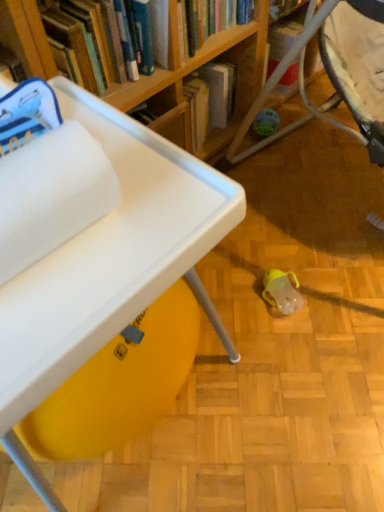
The width and height of the screenshot is (384, 512). What do you see at coordinates (51, 194) in the screenshot? I see `white fluffy towel at upper left` at bounding box center [51, 194].

You are a GUI agent. You are given a task and a screenshot of the screen. Output one action in this format:
    pyautogui.click(x=<x>, y=<y>)
    Task: Click on the white fluffy towel at upper left
    Image resolution: width=384 pixels, height=512 pixels.
    Given the screenshot: What is the action you would take?
    pyautogui.click(x=51, y=194)

Image resolution: width=384 pixels, height=512 pixels. Identify the location of wooden bookshelf at upper center. (196, 68).

Which of these two, white fluffy towel at upper left or wooden bookshelf at upper center, is smaller?

With smaller size is white fluffy towel at upper left.

Is point (17, 195) closer or farther from the camera than point (229, 47)?

Point (17, 195) is closer to the camera than point (229, 47).

Which object is thinner, white fluffy towel at upper left or wooden bookshelf at upper center?

Thinner between the two is white fluffy towel at upper left.

Which object is positioned more to the left, white fluffy towel at upper left or wooden bookshelf at upper center?

From the viewer's perspective, wooden bookshelf at upper center appears more on the left side.

From a real-world perspective, is white plastic table at lower left under wooden bookshelf at upper center?

Correct, in the physical world, white plastic table at lower left is lower than wooden bookshelf at upper center.

Is white plastic table at lower left beside wooden bookshelf at upper center?

They are not placed beside each other.

From the image's perspective, which object appears higher, white plastic table at lower left or wooden bookshelf at upper center?

wooden bookshelf at upper center.

Can you confirm if white plastic table at lower left is positioned to the left of wooden bookshelf at upper center?

Incorrect, white plastic table at lower left is not on the left side of wooden bookshelf at upper center.

From their relative heights in the image, would you say wooden bookshelf at upper center is taller or shorter than white fluffy towel at upper left?

Considering their sizes, wooden bookshelf at upper center has more height than white fluffy towel at upper left.

Looking at this image, is wooden bookshelf at upper center beside white fluffy towel at upper left?

wooden bookshelf at upper center is not next to white fluffy towel at upper left, and they're not touching.

You are a GUI agent. You are given a task and a screenshot of the screen. Output one action in this format:
    pyautogui.click(x=<x>, y=<y>)
    Task: Click on the toilet paper above the wooden bookshelf at upper center (from a real-world perspective)
    Image resolution: width=384 pixels, height=512 pixels.
    Given the screenshot: What is the action you would take?
    pyautogui.click(x=51, y=194)

Is white plastic table at lower left to the left of white fluffy towel at upper left from the viewer's perspective?

In fact, white plastic table at lower left is to the right of white fluffy towel at upper left.

In order to click on toilet paper positioned vertically above the white plastic table at lower left (from a real-world perspective) in this screenshot , I will do `click(51, 194)`.

From a real-world perspective, is white plastic table at lower left above or below white fluffy towel at upper left?

white plastic table at lower left is situated lower than white fluffy towel at upper left in the real world.

From the image's perspective, relative to white fluffy towel at upper left, is white plastic table at lower left above or below?

Based on their image positions, white plastic table at lower left is located beneath white fluffy towel at upper left.

Where is `toilet paper that appears above the white plastic table at lower left (from the image's perspective)`? toilet paper that appears above the white plastic table at lower left (from the image's perspective) is located at coordinates (51, 194).

Is white fluffy towel at upper left further to the viewer compared to white plastic table at lower left?

No, white fluffy towel at upper left is in front of white plastic table at lower left.

Considering the sizes of white fluffy towel at upper left and white plastic table at lower left in the image, is white fluffy towel at upper left bigger or smaller than white plastic table at lower left?

Considering their sizes, white fluffy towel at upper left takes up less space than white plastic table at lower left.

Between wooden bookshelf at upper center and white plastic table at lower left, which one has smaller width?

With smaller width is wooden bookshelf at upper center.

From the image's perspective, who appears lower, wooden bookshelf at upper center or white plastic table at lower left?

white plastic table at lower left, from the image's perspective.

Is point (226, 143) closer or farther from the camera than point (141, 238)?

Point (226, 143) is positioned farther from the camera compared to point (141, 238).

Where is `bookcase above the white fluffy towel at upper left (from the image's perspective)`? The height and width of the screenshot is (512, 384). bookcase above the white fluffy towel at upper left (from the image's perspective) is located at coordinates (196, 68).

Identify the location of table below the wooden bookshelf at upper center (from a real-world perspective). This screenshot has height=512, width=384. (112, 258).

From the image, which object appears to be farther from white plastic table at lower left, white fluffy towel at upper left or wooden bookshelf at upper center?

Based on the image, wooden bookshelf at upper center appears to be further to white plastic table at lower left.

When comparing their distances from white fluffy towel at upper left, does wooden bookshelf at upper center or white plastic table at lower left seem further?

wooden bookshelf at upper center is positioned further to the anchor white fluffy towel at upper left.

Estimate the real-world distances between objects in this image. Which object is further from white plastic table at lower left, wooden bookshelf at upper center or white fluffy towel at upper left?

The object further to white plastic table at lower left is wooden bookshelf at upper center.

Based on their spatial positions, is white plastic table at lower left or wooden bookshelf at upper center further from white fluffy towel at upper left?

wooden bookshelf at upper center is positioned further to the anchor white fluffy towel at upper left.

Looking at the image, which one is located closer to wooden bookshelf at upper center, white plastic table at lower left or white fluffy towel at upper left?

white plastic table at lower left is positioned closer to the anchor wooden bookshelf at upper center.

Looking at the image, which one is located closer to wooden bookshelf at upper center, white fluffy towel at upper left or white plastic table at lower left?

white plastic table at lower left is closer to wooden bookshelf at upper center.

Find the location of `toilet paper between wooden bookshelf at upper center and white plastic table at lower left from top to bottom`. toilet paper between wooden bookshelf at upper center and white plastic table at lower left from top to bottom is located at coordinates (51, 194).